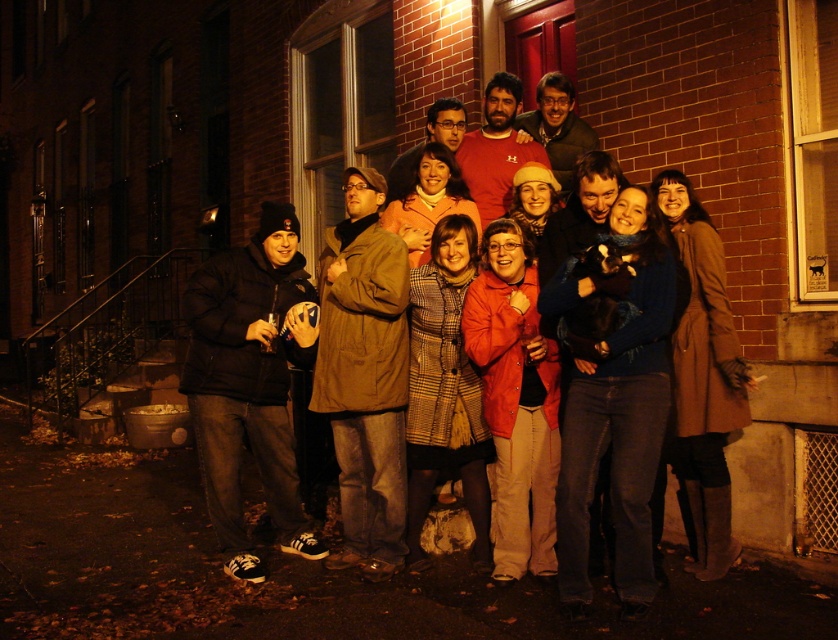
Question: Observing the image, what is the correct spatial positioning of black matte jacket at left in reference to brown matte coat at center?

Choices:
 (A) right
 (B) left

Answer: (B)

Question: Which point appears closest to the camera in this image?

Choices:
 (A) (360, 388)
 (B) (224, 266)

Answer: (A)

Question: Which point is farther to the camera?

Choices:
 (A) (226, 288)
 (B) (361, 502)

Answer: (B)

Question: Which point is farther to the camera?

Choices:
 (A) (287, 426)
 (B) (352, 275)

Answer: (A)

Question: Is black matte jacket at left to the right of brown matte coat at center from the viewer's perspective?

Choices:
 (A) yes
 (B) no

Answer: (B)

Question: Can you confirm if black matte jacket at left is positioned to the left of brown matte coat at center?

Choices:
 (A) no
 (B) yes

Answer: (B)